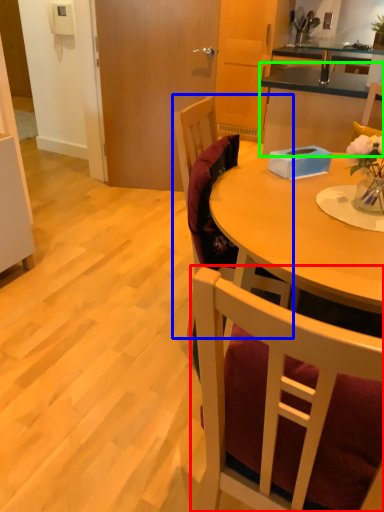
Question: Which object is the farthest from chair (highlighted by a red box)? Choose among these: chair (highlighted by a blue box) or cabinetry (highlighted by a green box).

Choices:
 (A) chair
 (B) cabinetry

Answer: (B)